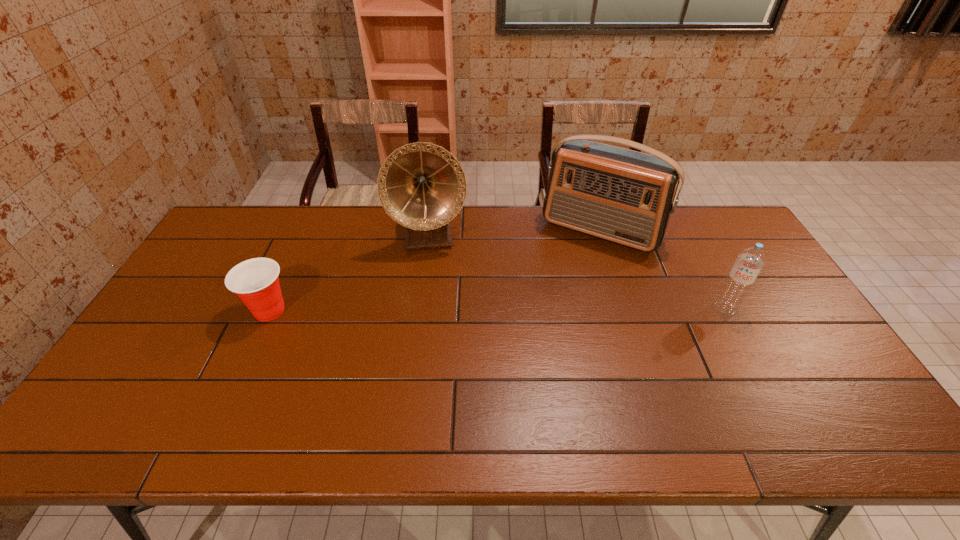
This screenshot has width=960, height=540. I want to click on the shortest object, so click(255, 281).

You are a GUI agent. You are given a task and a screenshot of the screen. Output one action in this format:
    pyautogui.click(x=<x>, y=<y>)
    Task: Click on the cup
    The height and width of the screenshot is (540, 960).
    Given the screenshot: What is the action you would take?
    [255, 281]

Image resolution: width=960 pixels, height=540 pixels. I want to click on the rightmost object, so click(x=751, y=260).

Where is `the third tallest object`? This screenshot has height=540, width=960. the third tallest object is located at coordinates (751, 260).

Where is `phonograph record`? This screenshot has height=540, width=960. phonograph record is located at coordinates (422, 186).

The width and height of the screenshot is (960, 540). What are the coordinates of `radio receiver` in the screenshot? It's located at (620, 195).

Image resolution: width=960 pixels, height=540 pixels. Identify the location of free space located on the back of the cup. (314, 214).

Identify the location of free space located 0.170m on the left of the water bottle. This screenshot has width=960, height=540. (654, 308).

What are the coordinates of `vacant region located on the horn of the third object from right to left` in the screenshot? It's located at (437, 315).

At what (x,y) coordinates should I click in order to perform the action: click on blank space located 0.270m on the horn of the third object from right to left. Please return your answer as a coordinate pair (x, y). Looking at the image, I should click on 438,320.